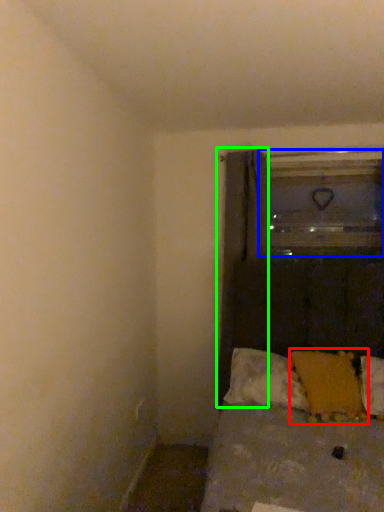
Question: Considering the real-world distances, which object is farthest from pillow (highlighted by a red box)? glass door (highlighted by a blue box) or curtain (highlighted by a green box)?

Choices:
 (A) glass door
 (B) curtain

Answer: (A)